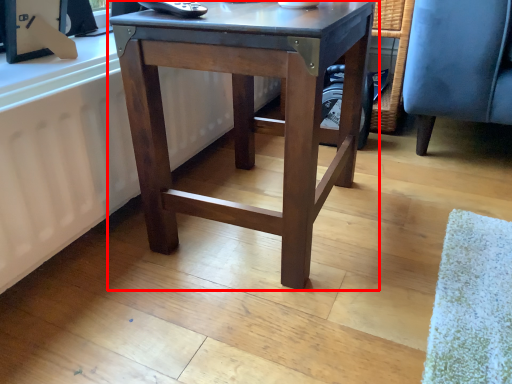
Question: From the image's perspective, where is table (annotated by the red box) located in relation to radiator in the image?

Choices:
 (A) above
 (B) below

Answer: (A)